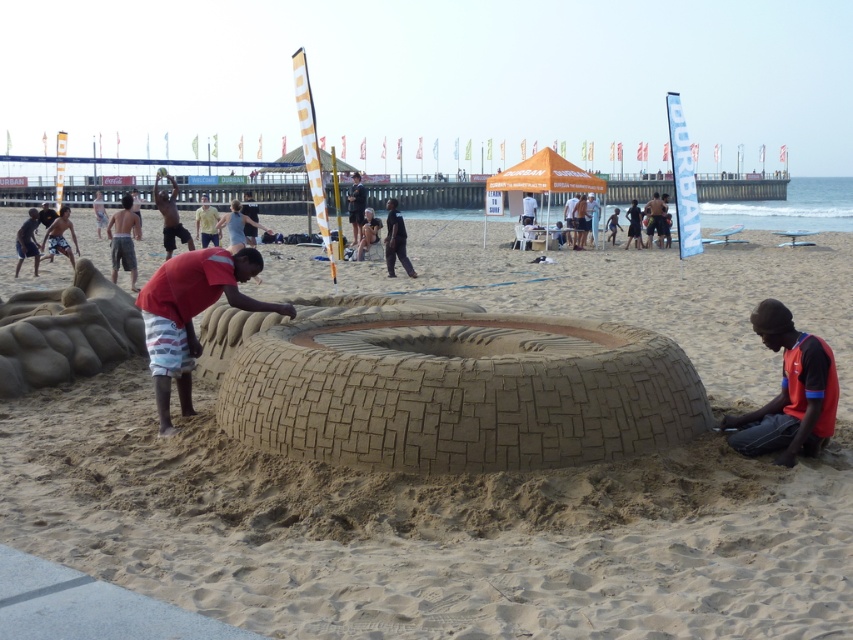
Is brown sand sculpture at center below dark skin person at center?

Indeed, brown sand sculpture at center is positioned under dark skin person at center.

Between brown sand sculpture at center and dark skin person at center, which one has less height?

brown sand sculpture at center

Measure the distance between brown sand sculpture at center and camera.

brown sand sculpture at center is 14.17 feet from camera.

Image resolution: width=853 pixels, height=640 pixels. I want to click on brown sand sculpture at center, so click(x=473, y=481).

Where is `beige textured sand sculpture at center`? This screenshot has height=640, width=853. beige textured sand sculpture at center is located at coordinates (451, 387).

Is beige textured sand sculpture at center bigger than dark red shirt at center?

Incorrect, beige textured sand sculpture at center is not larger than dark red shirt at center.

Is point (318, 365) farther from camera compared to point (572, 198)?

No.

Image resolution: width=853 pixels, height=640 pixels. Find the location of `beige textured sand sculpture at center`. beige textured sand sculpture at center is located at coordinates (451, 387).

What do you see at coordinates (123, 241) in the screenshot? I see `dark skin human at center` at bounding box center [123, 241].

Is dark skin human at center below skinny man at upper center?

Indeed, dark skin human at center is positioned under skinny man at upper center.

Is point (131, 256) positioned after point (175, 214)?

No, it is not.

The width and height of the screenshot is (853, 640). I want to click on dark skin human at center, so click(123, 241).